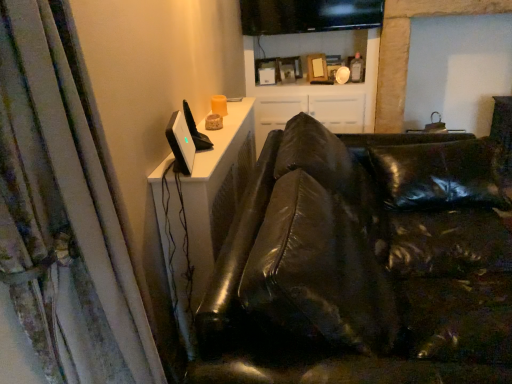
Question: Can you confirm if satin black monitor at upper left, positioned as the second computer monitor in right-to-left order, is bigger than white textured curtain at left?

Choices:
 (A) no
 (B) yes

Answer: (A)

Question: From the image's perspective, is satin black monitor at upper left, the second computer monitor when ordered from back to front, located beneath white textured curtain at left?

Choices:
 (A) no
 (B) yes

Answer: (A)

Question: Does satin black monitor at upper left, the second computer monitor when ordered from back to front, come in front of white textured curtain at left?

Choices:
 (A) yes
 (B) no

Answer: (B)

Question: Is satin black monitor at upper left, the second computer monitor when ordered from back to front, next to white textured curtain at left and touching it?

Choices:
 (A) no
 (B) yes

Answer: (A)

Question: Is satin black monitor at upper left, the first computer monitor when ordered from left to right, far from white textured curtain at left?

Choices:
 (A) no
 (B) yes

Answer: (A)

Question: Is satin black monitor at upper left, arranged as the 1th computer monitor when ordered from the bottom, to the left or to the right of black leather couch at center in the image?

Choices:
 (A) left
 (B) right

Answer: (A)

Question: Is point [174, 117] positioned closer to the camera than point [296, 183]?

Choices:
 (A) closer
 (B) farther

Answer: (B)

Question: In terms of width, does satin black monitor at upper left, the 2th computer monitor when ordered from top to bottom, look wider or thinner when compared to black leather couch at center?

Choices:
 (A) thin
 (B) wide

Answer: (A)

Question: From a real-world perspective, is satin black monitor at upper left, arranged as the 1th computer monitor when ordered from the bottom, positioned above or below black leather couch at center?

Choices:
 (A) above
 (B) below

Answer: (A)

Question: Is point pos(313,0) positioned closer to the camera than point pos(54,331)?

Choices:
 (A) closer
 (B) farther

Answer: (B)

Question: Relative to white textured curtain at left, is black glossy monitor at upper center, which is the first computer monitor from top to bottom, in front or behind?

Choices:
 (A) behind
 (B) front

Answer: (A)

Question: Is black glossy monitor at upper center, which is the first computer monitor from back to front, taller or shorter than white textured curtain at left?

Choices:
 (A) short
 (B) tall

Answer: (A)

Question: Looking at the image, does black glossy monitor at upper center, which is counted as the 2th computer monitor, starting from the bottom, seem bigger or smaller compared to white textured curtain at left?

Choices:
 (A) big
 (B) small

Answer: (B)

Question: From their relative heights in the image, would you say satin black monitor at upper left, positioned as the second computer monitor in right-to-left order, is taller or shorter than black glossy monitor at upper center, the second computer monitor positioned from the front?

Choices:
 (A) short
 (B) tall

Answer: (A)

Question: Is satin black monitor at upper left, the 2th computer monitor when ordered from top to bottom, situated inside black glossy monitor at upper center, the first computer monitor positioned from the right, or outside?

Choices:
 (A) inside
 (B) outside

Answer: (B)